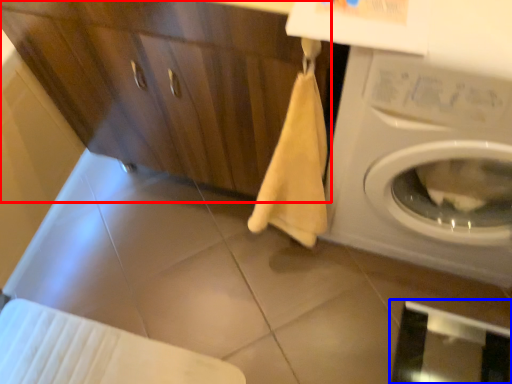
Question: Which object is further to the camera taking this photo, dresser (highlighted by a red box) or screen door (highlighted by a blue box)?

Choices:
 (A) dresser
 (B) screen door

Answer: (B)